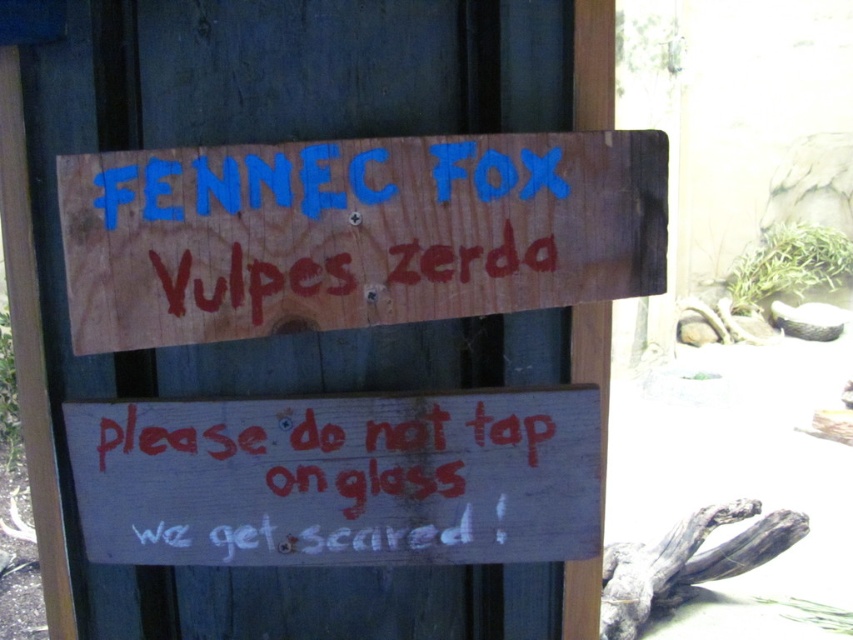
Does wooden signboard at upper center have a greater height compared to white painted wood sign at lower center?

Yes, wooden signboard at upper center is taller than white painted wood sign at lower center.

Who is lower down, wooden signboard at upper center or white painted wood sign at lower center?

white painted wood sign at lower center

Does point (216, 152) come closer to viewer compared to point (347, 500)?

Yes, point (216, 152) is in front of point (347, 500).

At what (x,y) coordinates should I click in order to perform the action: click on wooden signboard at upper center. Please return your answer as a coordinate pair (x, y). The width and height of the screenshot is (853, 640). Looking at the image, I should click on (355, 232).